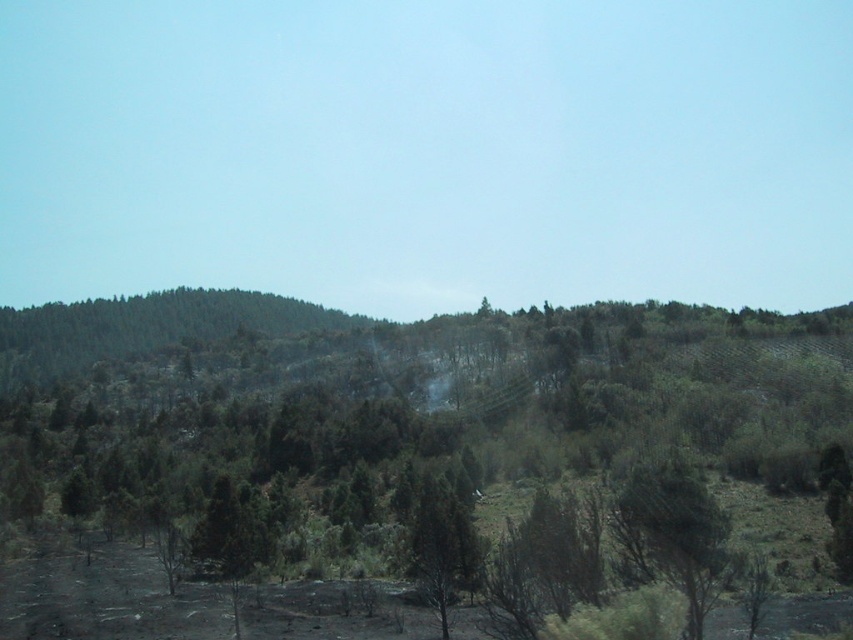
Question: Is green leafy tree at center behind green textured tree at center?

Choices:
 (A) no
 (B) yes

Answer: (A)

Question: Is green textured tree at center smaller than green matte tree at center?

Choices:
 (A) yes
 (B) no

Answer: (A)

Question: Considering the relative positions of green textured tree at center and green matte tree at center in the image provided, where is green textured tree at center located with respect to green matte tree at center?

Choices:
 (A) right
 (B) left

Answer: (A)

Question: Which point is farther to the camera?

Choices:
 (A) (666, 509)
 (B) (399, 465)
 (C) (453, 528)

Answer: (B)

Question: Which point appears closest to the camera in this image?

Choices:
 (A) (439, 568)
 (B) (403, 448)

Answer: (A)

Question: Which point is farther to the camera?

Choices:
 (A) green leafy tree at center
 (B) green matte tree at center
 (C) green textured tree at center

Answer: (B)